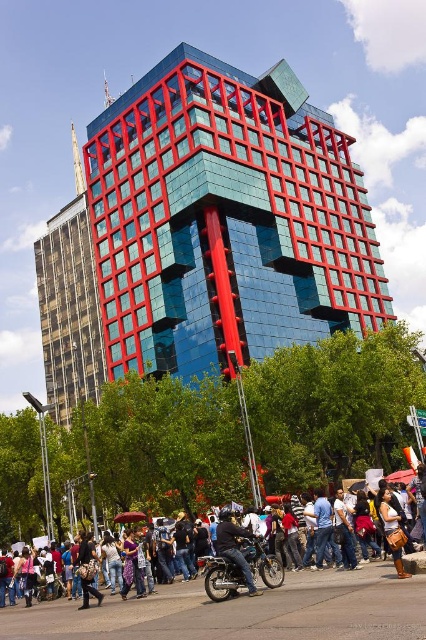
You are a photographer trying to capture the modern building in the background. You notice the matte black crowd at lower center and the shiny black motorcycle at center are blocking your view. Which object is taller and thus more likely to obstruct your shot?

The matte black crowd at lower center has a greater height compared to the shiny black motorcycle at center, so it is more likely to obstruct your shot.

You are a delivery person who needs to quickly pass through the area between the matte black crowd at lower center and the shiny chrome motorbike at center. The delivery robot you are using has a width of 1.2 meters. Can you safely navigate through this space?

The distance between the matte black crowd at lower center and the shiny chrome motorbike at center is 1.58 meters. Since the robot is 1.2 meters wide, there is enough space to pass safely as 1.58 meters is greater than 1.2 meters.

You are a delivery person needing to park your vehicle between two poles that are 2 meters apart. You have a shiny chrome motorbike at center and a shiny black motorcycle at center. Which vehicle can fit through the space without touching the poles?

The shiny black motorcycle at center can fit through the space between the poles since it is narrower than the shiny chrome motorbike at center, which might be wider and thus may not fit within the 2 meters.